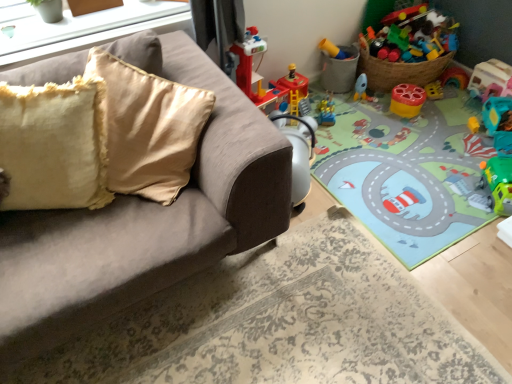
This screenshot has height=384, width=512. I want to click on vacant space that's between yellow plastic cup at center-right, acting as the 4th toy starting from the right, and translucent plastic toy at center, the 1th toy positioned from the left, so click(364, 113).